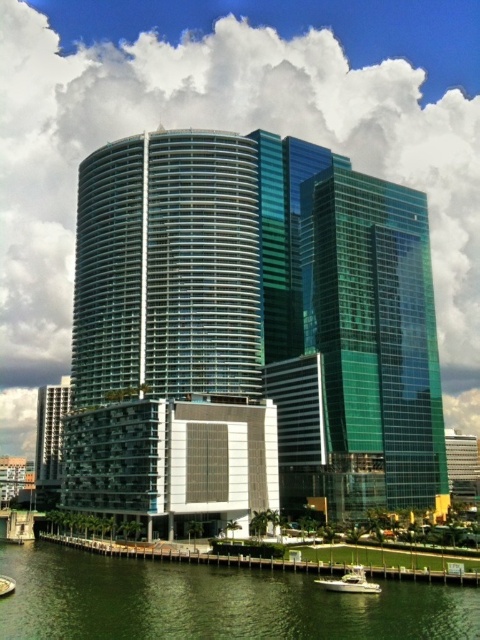
Question: Can you confirm if shiny glass skyscraper at center is wider than green wooden dock at lower center?

Choices:
 (A) no
 (B) yes

Answer: (B)

Question: Estimate the real-world distances between objects in this image. Which object is closer to the white glossy boat at lower center?

Choices:
 (A) green water at lower center
 (B) shiny glass skyscraper at center
 (C) green wooden dock at lower center

Answer: (C)

Question: Estimate the real-world distances between objects in this image. Which object is closer to the green water at lower center?

Choices:
 (A) green wooden dock at lower center
 (B) white glossy boat at lower center
 (C) shiny glass skyscraper at center

Answer: (A)

Question: Which of these objects is positioned closest to the shiny glass skyscraper at center?

Choices:
 (A) green water at lower center
 (B) green wooden dock at lower center

Answer: (B)

Question: Observing the image, what is the correct spatial positioning of shiny glass skyscraper at center in reference to green water at lower center?

Choices:
 (A) below
 (B) above

Answer: (B)

Question: Is shiny glass skyscraper at center thinner than green water at lower center?

Choices:
 (A) yes
 (B) no

Answer: (B)